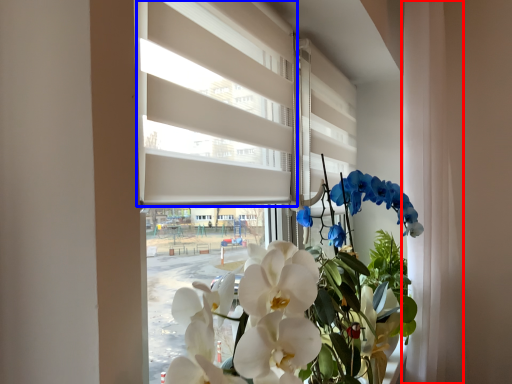
Question: Which object is closer to the camera taking this photo, curtain (highlighted by a red box) or blind (highlighted by a blue box)?

Choices:
 (A) curtain
 (B) blind

Answer: (B)